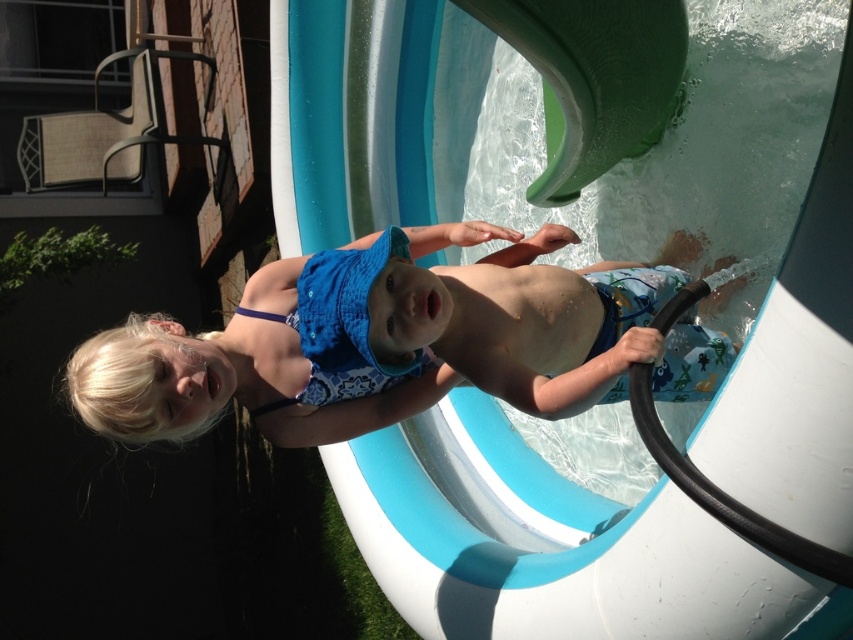
You are a parent supervising the children in the backyard. You notice the green rubber slide at upper center and the blue fabric swimsuit at center. Which object is located below the other?

The green rubber slide at upper center is positioned under the blue fabric swimsuit at center, so the slide is below the swimsuit.

You are standing at the edge of the inflatable pool and want to reach the green rubber slide at upper center. If your maximum reach is 1.5 meters, can you touch the slide without moving closer?

The distance between you and the green rubber slide at upper center is 1.59 meters, which is slightly beyond your 1.5 meter reach. You cannot touch the slide without moving closer.

You are a parent supervising the children in the backyard. You notice the green rubber slide at upper center and the blue fabric swimsuit at center. Which object is narrower in width?

The green rubber slide at upper center is thinner than the blue fabric swimsuit at center, so the green rubber slide at upper center is narrower in width.